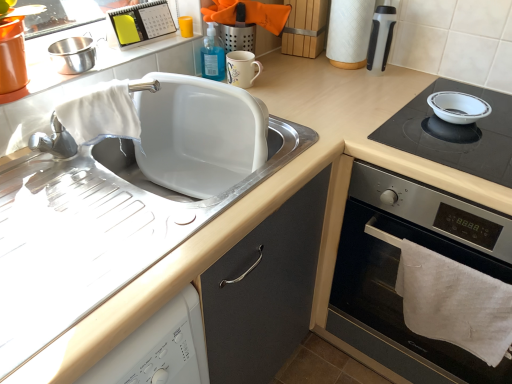
Where is `free location to the left of white paper towel at upper right`? This screenshot has width=512, height=384. free location to the left of white paper towel at upper right is located at coordinates (304, 73).